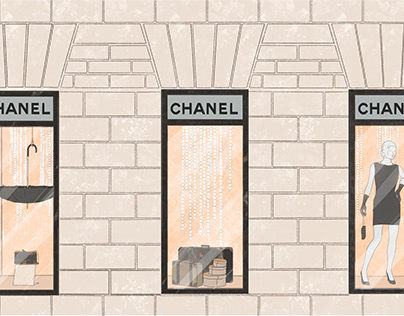
Find the location of a particular element. This screenshot has width=404, height=316. top of window is located at coordinates (203, 73).